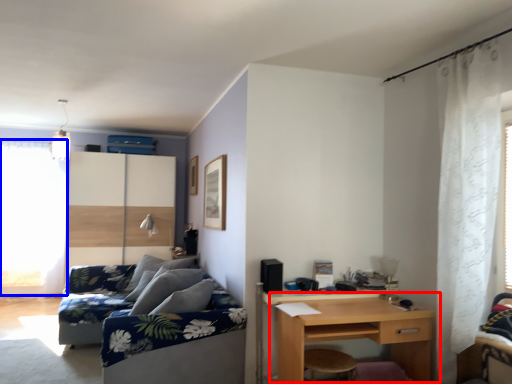
Question: Which object is closer to the camera taking this photo, desk (highlighted by a red box) or window screen (highlighted by a blue box)?

Choices:
 (A) desk
 (B) window screen

Answer: (A)